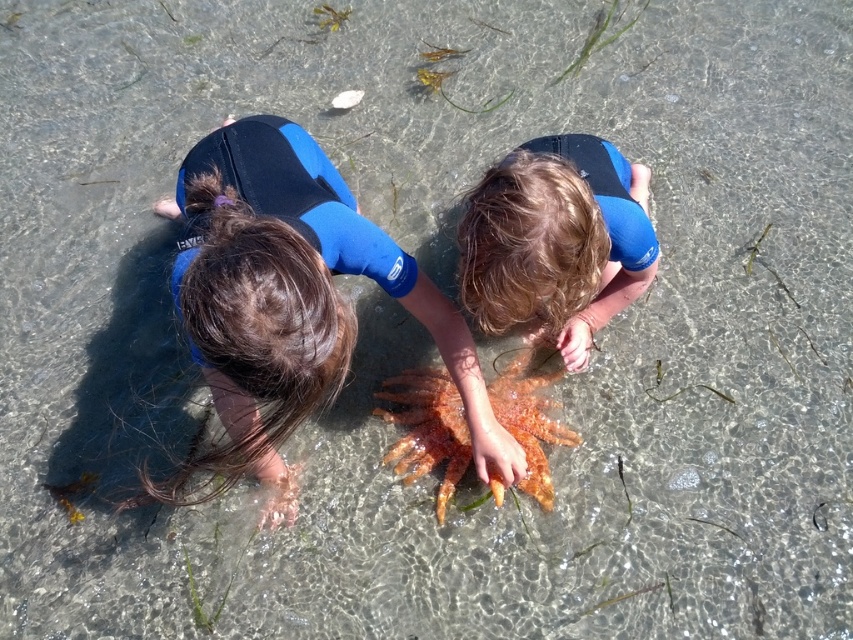
Who is positioned more to the left, blue neoprene wetsuit at center or smooth blue wetsuit at center?

From the viewer's perspective, blue neoprene wetsuit at center appears more on the left side.

Is blue neoprene wetsuit at center wider than smooth blue wetsuit at center?

Yes, blue neoprene wetsuit at center is wider than smooth blue wetsuit at center.

You are a GUI agent. You are given a task and a screenshot of the screen. Output one action in this format:
    pyautogui.click(x=<x>, y=<y>)
    Task: Click on the blue neoprene wetsuit at center
    This screenshot has height=640, width=853.
    Given the screenshot: What is the action you would take?
    pyautogui.click(x=294, y=307)

Identify the location of blue neoprene wetsuit at center. (294, 307).

Consider the image. Measure the distance between blue neoprene wetsuit at center and orange rough starfish at center.

blue neoprene wetsuit at center and orange rough starfish at center are 14.26 inches apart.

Between blue neoprene wetsuit at center and orange rough starfish at center, which one is positioned higher?

blue neoprene wetsuit at center is higher up.

Which is in front, point (341, 250) or point (404, 371)?

Point (341, 250) is in front.

The width and height of the screenshot is (853, 640). I want to click on blue neoprene wetsuit at center, so click(294, 307).

Which is below, smooth blue wetsuit at center or blue neoprene wetsuit at upper center?

Positioned lower is smooth blue wetsuit at center.

Between smooth blue wetsuit at center and blue neoprene wetsuit at upper center, which one has more height?

With more height is smooth blue wetsuit at center.

What do you see at coordinates (556, 241) in the screenshot? The height and width of the screenshot is (640, 853). I see `smooth blue wetsuit at center` at bounding box center [556, 241].

Identify the location of smooth blue wetsuit at center. Image resolution: width=853 pixels, height=640 pixels. (556, 241).